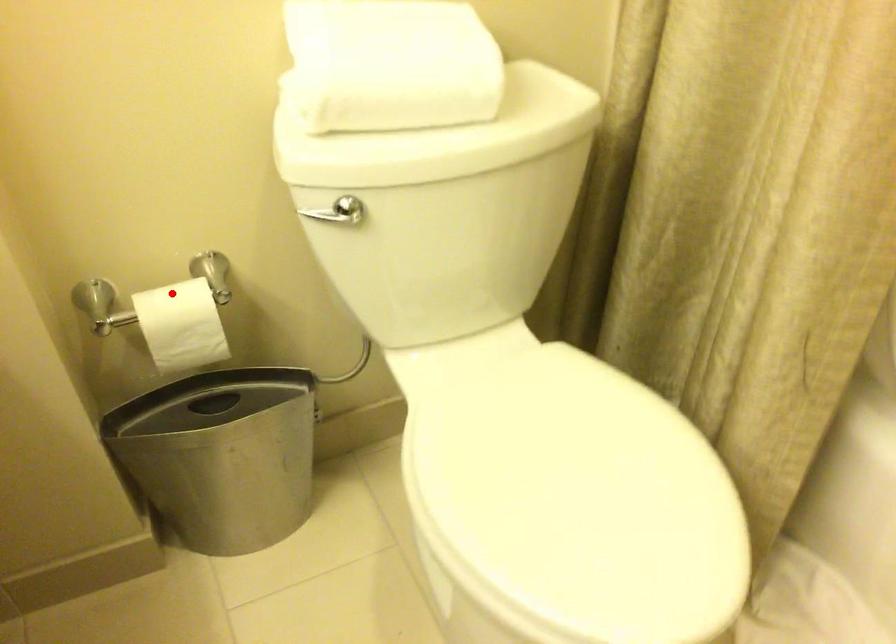
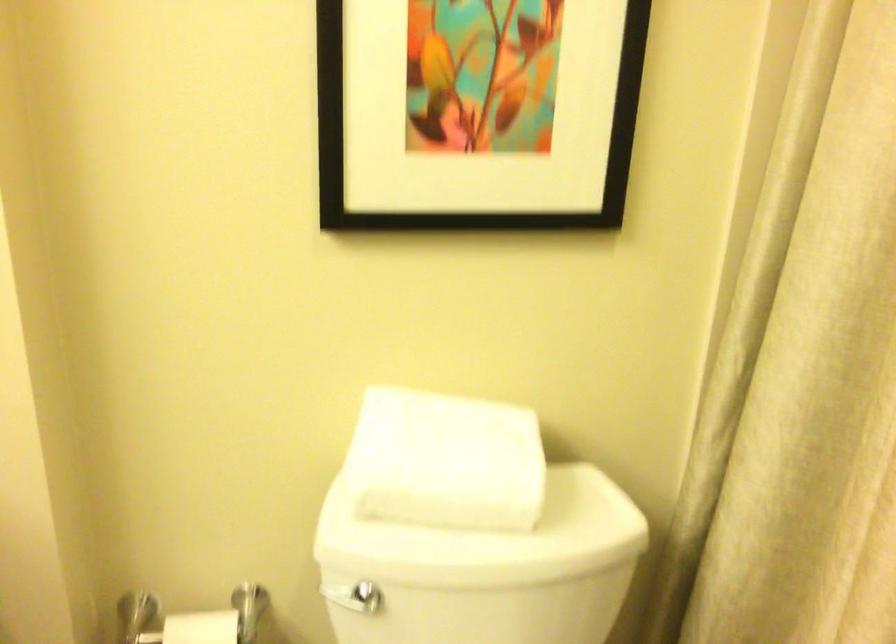
Question: I am providing you with two images of the same scene from different viewpoints. A red point is marked on the first image. At the location where the point appears in image 1, is it still visible in image 2?

Choices:
 (A) Yes
 (B) No

Answer: (A)